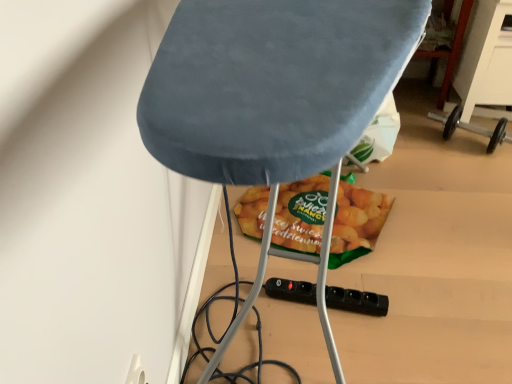
Question: Is velvet blue ironing board at center not within black plastic socket at lower center?

Choices:
 (A) no
 (B) yes

Answer: (B)

Question: Is velvet blue ironing board at center wider than black plastic socket at lower center?

Choices:
 (A) no
 (B) yes

Answer: (B)

Question: Can you confirm if velvet blue ironing board at center is bigger than black plastic socket at lower center?

Choices:
 (A) no
 (B) yes

Answer: (B)

Question: Does velvet blue ironing board at center contain black plastic socket at lower center?

Choices:
 (A) no
 (B) yes

Answer: (B)

Question: Is velvet blue ironing board at center at the right side of black plastic socket at lower center?

Choices:
 (A) yes
 (B) no

Answer: (B)

Question: Looking at their shapes, would you say green matte snack at center is wider or thinner than black plastic socket at lower center?

Choices:
 (A) thin
 (B) wide

Answer: (B)

Question: Considering their positions, is green matte snack at center located in front of or behind black plastic socket at lower center?

Choices:
 (A) front
 (B) behind

Answer: (B)

Question: In terms of height, does green matte snack at center look taller or shorter compared to black plastic socket at lower center?

Choices:
 (A) short
 (B) tall

Answer: (B)

Question: From a real-world perspective, is green matte snack at center physically located above or below black plastic socket at lower center?

Choices:
 (A) below
 (B) above

Answer: (A)

Question: Considering the positions of point (332, 157) and point (351, 311), is point (332, 157) closer or farther from the camera than point (351, 311)?

Choices:
 (A) farther
 (B) closer

Answer: (B)

Question: From their relative heights in the image, would you say velvet blue ironing board at center is taller or shorter than black plastic socket at lower center?

Choices:
 (A) tall
 (B) short

Answer: (A)

Question: From a real-world perspective, is velvet blue ironing board at center above or below black plastic socket at lower center?

Choices:
 (A) below
 (B) above

Answer: (B)

Question: Based on their sizes in the image, would you say velvet blue ironing board at center is bigger or smaller than black plastic socket at lower center?

Choices:
 (A) small
 (B) big

Answer: (B)

Question: From their relative heights in the image, would you say black plastic socket at lower center is taller or shorter than green matte snack at center?

Choices:
 (A) tall
 (B) short

Answer: (B)

Question: Is point (386, 312) closer or farther from the camera than point (361, 230)?

Choices:
 (A) farther
 (B) closer

Answer: (B)